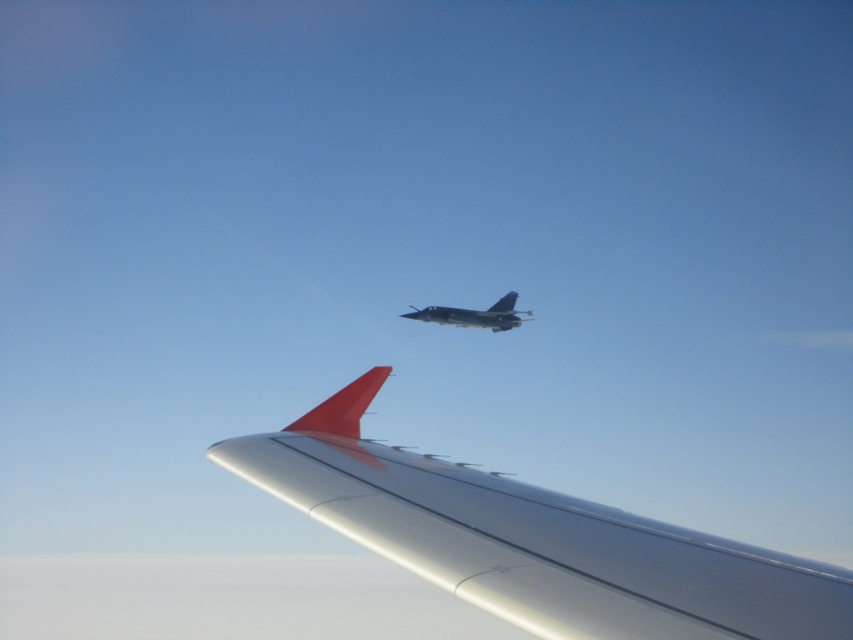
Question: Is silver metallic wing at upper center behind shiny metallic jet at center?

Choices:
 (A) yes
 (B) no

Answer: (B)

Question: Does silver metallic wing at upper center come in front of shiny metallic jet at center?

Choices:
 (A) no
 (B) yes

Answer: (B)

Question: Which of the following is the farthest from the observer?

Choices:
 (A) silver metallic wing at upper center
 (B) shiny metallic jet at center

Answer: (B)

Question: Which point is farther from the camera taking this photo?

Choices:
 (A) (646, 570)
 (B) (467, 312)

Answer: (B)

Question: Does silver metallic wing at upper center appear over shiny metallic jet at center?

Choices:
 (A) no
 (B) yes

Answer: (A)

Question: Which object is closer to the camera taking this photo?

Choices:
 (A) silver metallic wing at upper center
 (B) shiny metallic jet at center

Answer: (A)